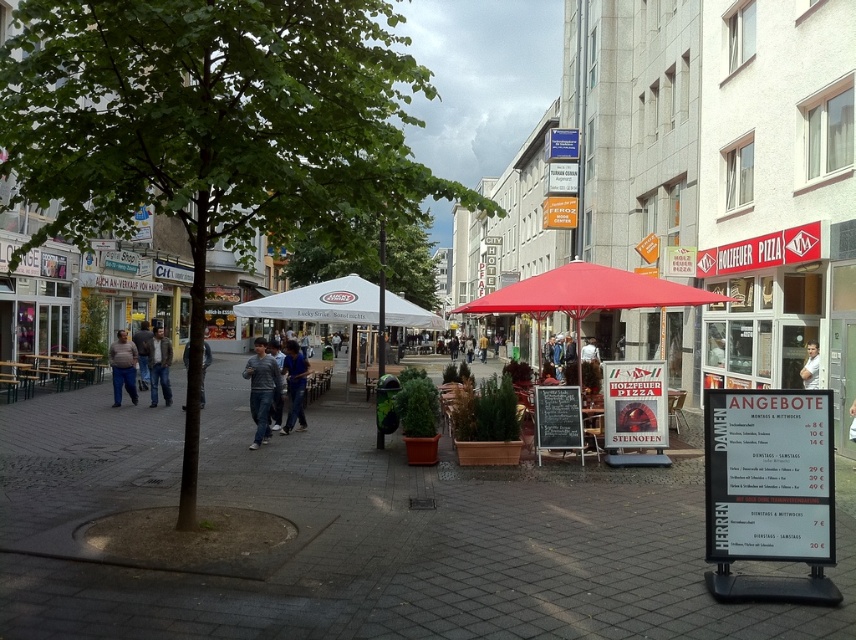
Between point (290, 374) and point (805, 371), which one is positioned in front?

Point (805, 371) is in front.

This screenshot has height=640, width=856. Find the location of `blue jeans at center`. blue jeans at center is located at coordinates (294, 385).

Does point (277, 376) come farther from viewer compared to point (131, 336)?

No, it is not.

From the picture: Does gray cotton hoodie at center have a smaller size compared to dark gray sweater at center?

No.

Between point (248, 360) and point (141, 380), which one is positioned behind?

The point (141, 380) is more distant.

Where is `gray cotton hoodie at center`? The height and width of the screenshot is (640, 856). gray cotton hoodie at center is located at coordinates (260, 388).

Which is below, smooth concrete pavement at center or matte gray shirt at center?

Answer: smooth concrete pavement at center is lower down.

Who is more forward, (518,516) or (134,365)?

Point (518,516) is in front.

Identify the location of smooth concrete pavement at center. The image size is (856, 640). (424, 548).